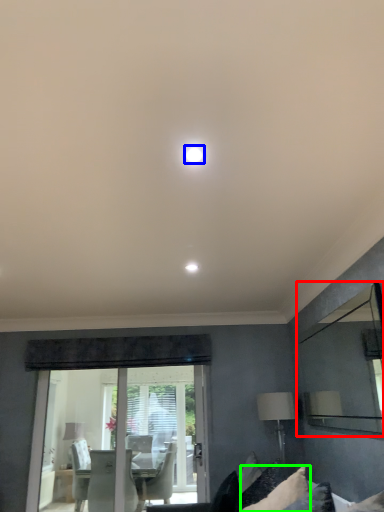
Question: Which object is the closest to the mirror (highlighted by a red box)? Choose among these: lighting (highlighted by a blue box) or pillow (highlighted by a green box).

Choices:
 (A) lighting
 (B) pillow

Answer: (B)